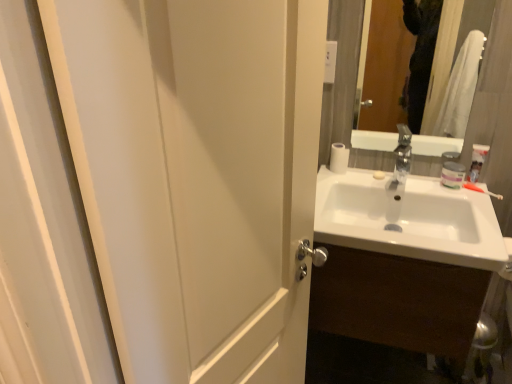
Locate an element on the screen. Image resolution: width=512 pixels, height=384 pixels. free space on the front side of white matte toilet paper at upper right is located at coordinates pos(345,178).